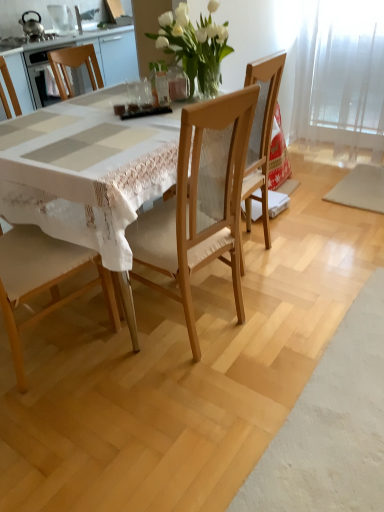
Question: Considering the relative sizes of metallic teapot at upper left, which is counted as the 1th appliance, starting from the left, and wooden table at center in the image provided, is metallic teapot at upper left, which is counted as the 1th appliance, starting from the left, thinner than wooden table at center?

Choices:
 (A) yes
 (B) no

Answer: (A)

Question: Can you confirm if metallic teapot at upper left, which is counted as the 1th appliance, starting from the left, is taller than wooden table at center?

Choices:
 (A) no
 (B) yes

Answer: (A)

Question: Considering the relative positions of metallic teapot at upper left, positioned as the 2th appliance in right-to-left order, and wooden table at center in the image provided, is metallic teapot at upper left, positioned as the 2th appliance in right-to-left order, in front of wooden table at center?

Choices:
 (A) no
 (B) yes

Answer: (A)

Question: Does metallic teapot at upper left, which is counted as the 1th appliance, starting from the left, have a greater width compared to wooden table at center?

Choices:
 (A) yes
 (B) no

Answer: (B)

Question: Considering the relative sizes of metallic teapot at upper left, positioned as the 2th appliance in right-to-left order, and wooden table at center in the image provided, is metallic teapot at upper left, positioned as the 2th appliance in right-to-left order, smaller than wooden table at center?

Choices:
 (A) yes
 (B) no

Answer: (A)

Question: From the image's perspective, is transparent glass door at upper right positioned above or below wooden table at center?

Choices:
 (A) above
 (B) below

Answer: (A)

Question: From a real-world perspective, is transparent glass door at upper right positioned above or below wooden table at center?

Choices:
 (A) above
 (B) below

Answer: (A)

Question: Considering the positions of transparent glass door at upper right and wooden table at center in the image, is transparent glass door at upper right wider or thinner than wooden table at center?

Choices:
 (A) thin
 (B) wide

Answer: (A)

Question: Considering the positions of transparent glass door at upper right and wooden table at center in the image, is transparent glass door at upper right bigger or smaller than wooden table at center?

Choices:
 (A) big
 (B) small

Answer: (B)

Question: Considering the positions of point (183, 52) and point (31, 31), is point (183, 52) closer or farther from the camera than point (31, 31)?

Choices:
 (A) closer
 (B) farther

Answer: (A)

Question: Would you say white glass vase at upper center is to the left or to the right of metallic teapot at upper left, which is counted as the 1th appliance, starting from the left, in the picture?

Choices:
 (A) right
 (B) left

Answer: (A)

Question: Looking at their shapes, would you say white glass vase at upper center is wider or thinner than metallic teapot at upper left, which is counted as the 1th appliance, starting from the left?

Choices:
 (A) wide
 (B) thin

Answer: (A)

Question: Considering the positions of white glass vase at upper center and metallic teapot at upper left, which is counted as the 1th appliance, starting from the left, in the image, is white glass vase at upper center taller or shorter than metallic teapot at upper left, which is counted as the 1th appliance, starting from the left,?

Choices:
 (A) short
 (B) tall

Answer: (B)

Question: From the image's perspective, relative to wooden table at center, is wooden chair at center, which is the first chair in right-to-left order, above or below?

Choices:
 (A) above
 (B) below

Answer: (A)

Question: In terms of height, does wooden chair at center, which is the first chair in right-to-left order, look taller or shorter compared to wooden table at center?

Choices:
 (A) short
 (B) tall

Answer: (B)